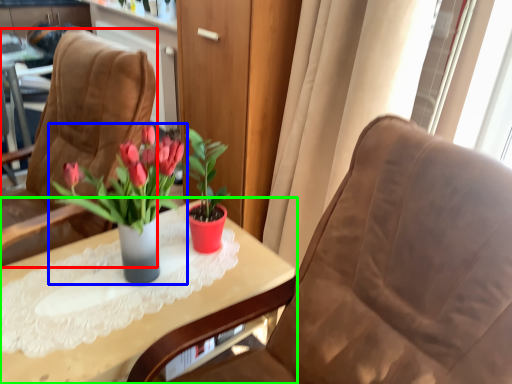
Question: Which object is positioned farthest from chair (highlighted by a red box)? Select from houseplant (highlighted by a blue box) and table (highlighted by a green box).

Choices:
 (A) houseplant
 (B) table

Answer: (B)